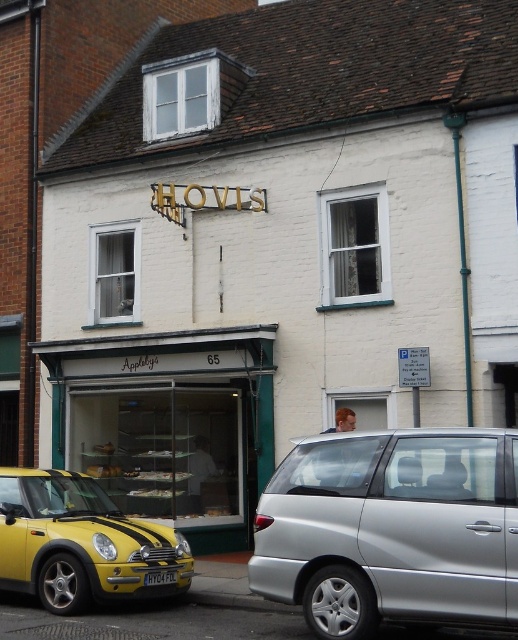
Question: Is matte glass storefront at center below yellow matte car at lower left?

Choices:
 (A) yes
 (B) no

Answer: (B)

Question: Which is nearer to the yellow plastic license plate at lower center?

Choices:
 (A) silver metallic van at lower right
 (B) matte glass storefront at center

Answer: (A)

Question: Can you confirm if matte glass storefront at center is smaller than yellow matte car at lower left?

Choices:
 (A) yes
 (B) no

Answer: (B)

Question: Which object is farther from the camera taking this photo?

Choices:
 (A) silver metallic van at lower right
 (B) matte glass storefront at center

Answer: (B)

Question: Which is nearer to the silver metallic van at lower right?

Choices:
 (A) yellow matte car at lower left
 (B) yellow plastic license plate at lower center

Answer: (A)

Question: Is silver metallic van at lower right positioned before yellow plastic license plate at lower center?

Choices:
 (A) yes
 (B) no

Answer: (A)